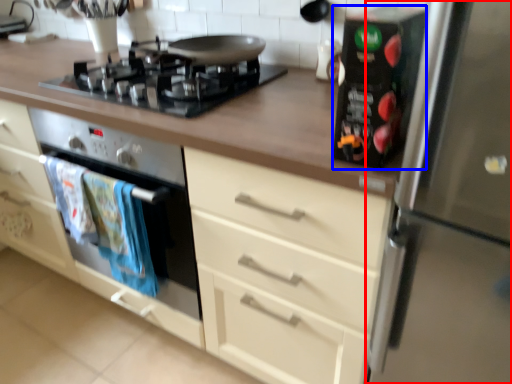
Question: Which object appears farthest to the camera in this image, refrigerator (highlighted by a red box) or appliance (highlighted by a blue box)?

Choices:
 (A) refrigerator
 (B) appliance

Answer: (B)